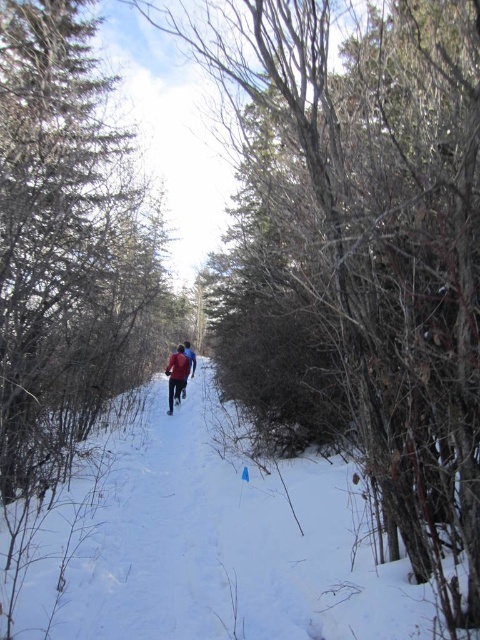
You are planning to build a snowman using the white powdery snow at center and wearing the red fabric jacket at center. Will there be enough snow to cover the jacket completely?

The white powdery snow at center occupies less space than red fabric jacket at center, so there won not be enough snow to cover the jacket completely.

You are standing at the edge of the snowy trail and see the white powdery snow at center and the red fabric jacket at center. Which object is positioned more to the left?

The white powdery snow at center is positioned more to the left than the red fabric jacket at center according to the description.